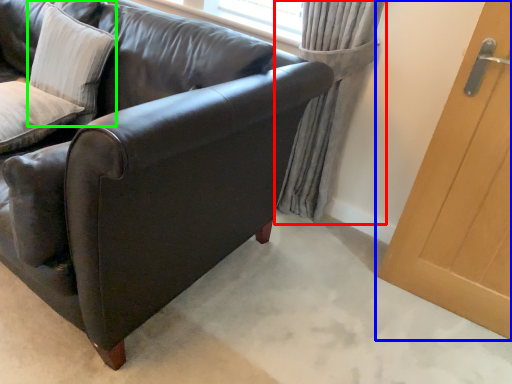
Question: Considering the real-world distances, which object is closest to curtain (highlighted by a red box)? door (highlighted by a blue box) or pillow (highlighted by a green box).

Choices:
 (A) door
 (B) pillow

Answer: (A)